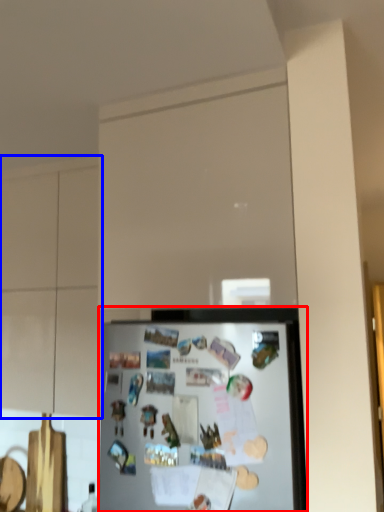
Question: Among these objects, which one is nearest to the camera, refrigerator (highlighted by a red box) or cabinetry (highlighted by a blue box)?

Choices:
 (A) refrigerator
 (B) cabinetry

Answer: (A)